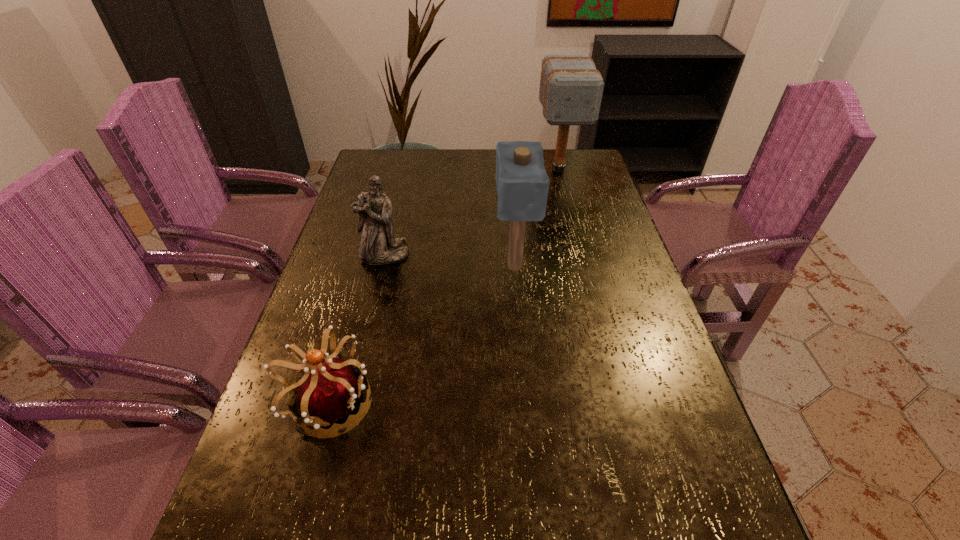
The height and width of the screenshot is (540, 960). In order to click on the farther mallet in this screenshot , I will do [571, 87].

This screenshot has height=540, width=960. In order to click on the farthest object in this screenshot , I will do `click(571, 87)`.

I want to click on the third object from left to right, so click(522, 183).

You are a GUI agent. You are given a task and a screenshot of the screen. Output one action in this format:
    pyautogui.click(x=<x>, y=<y>)
    Task: Click on the left mallet
    This screenshot has height=540, width=960.
    Given the screenshot: What is the action you would take?
    (522, 183)

The height and width of the screenshot is (540, 960). Find the location of `figurine`. figurine is located at coordinates (378, 246).

You are a GUI agent. You are given a task and a screenshot of the screen. Output one action in this format:
    pyautogui.click(x=<x>, y=<y>)
    Task: Click on the nearest object
    
    Given the screenshot: What is the action you would take?
    pyautogui.click(x=328, y=391)

Where is `the shortest object`? The image size is (960, 540). the shortest object is located at coordinates (328, 391).

I want to click on vacant position located 0.290m on the striking surface of the farthest object, so click(x=577, y=242).

The height and width of the screenshot is (540, 960). I want to click on vacant region located 0.190m on the left of the left mallet, so click(x=423, y=265).

In order to click on free space located 0.210m on the front-facing side of the second shortest object in this screenshot , I will do `click(367, 325)`.